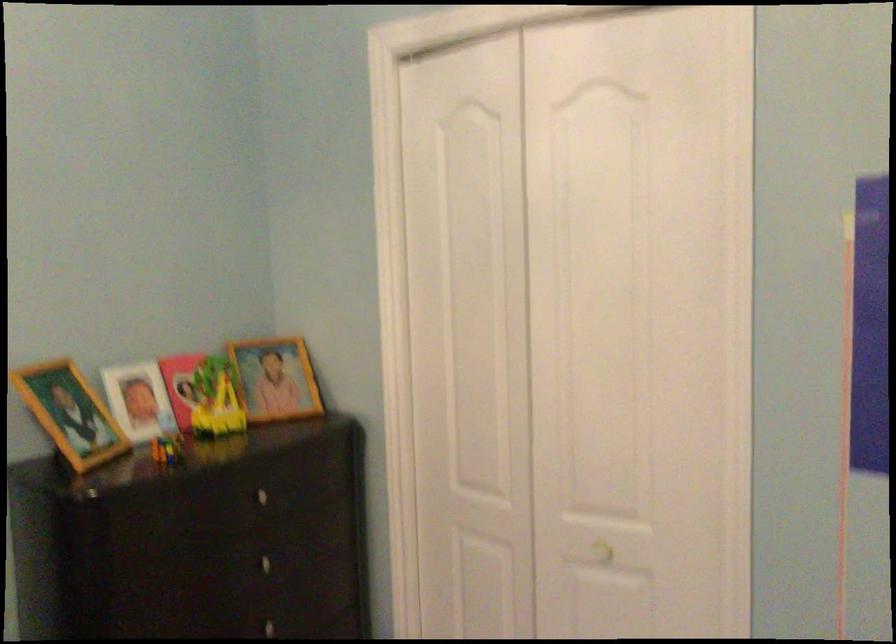
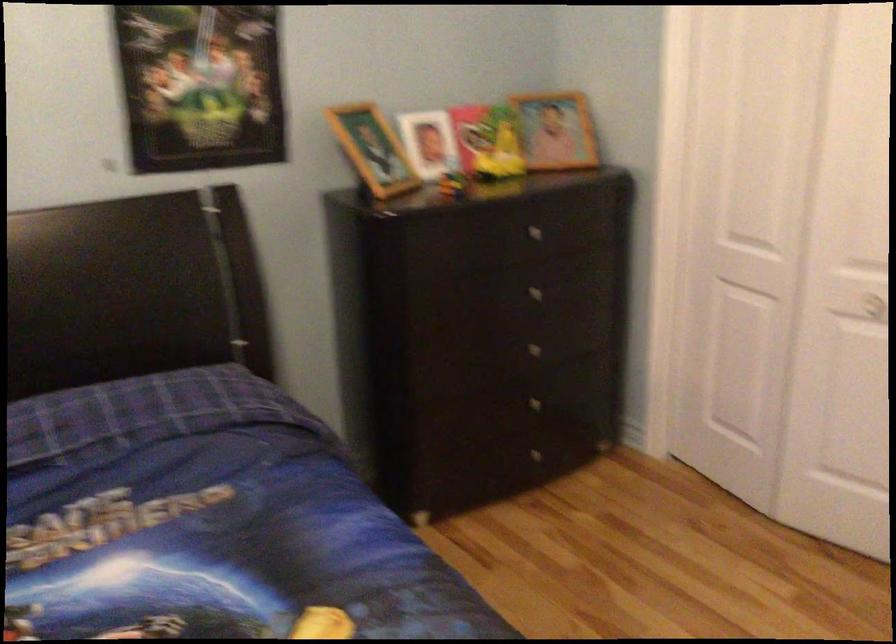
The point at (270, 565) is marked in the first image. Where is the corresponding point in the second image?

(538, 292)